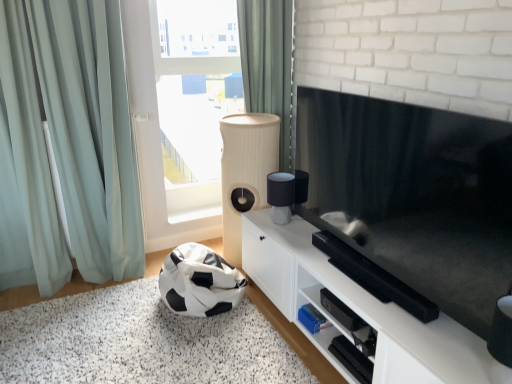
Identify the location of vacant area situated below light blue fabric curtain at left, positioned as the 1th curtain in left-to-right order (from a real-world perspective). The image size is (512, 384). (68, 287).